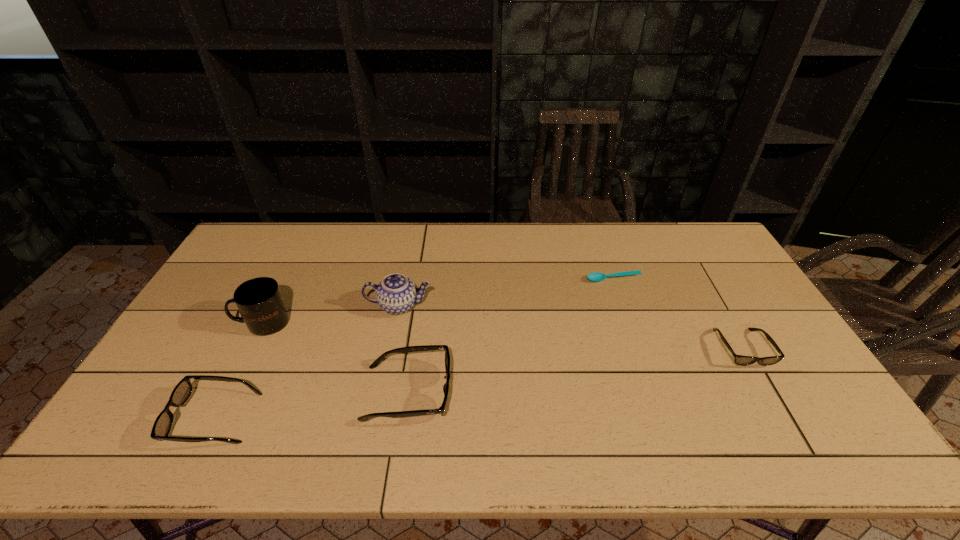
I want to click on blank space that satisfies the following two spatial constraints: 1. at the spout of the chinaware; 2. on the lenses of the third shortest object, so click(x=377, y=418).